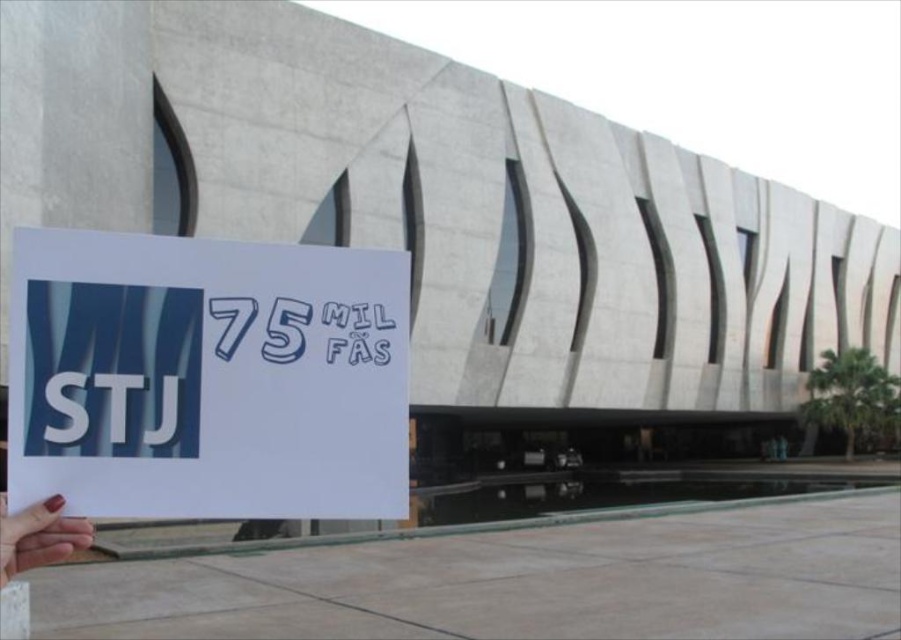
What is the 2D coordinate of the white paper at center?

The white paper at center is located at the 2D coordinate point of (207, 378).

You are an architect examining a model of a building. The model has a white paper at center and a smooth skin hand at lower left. Which object is wider?

The white paper at center is wider than the smooth skin hand at lower left.